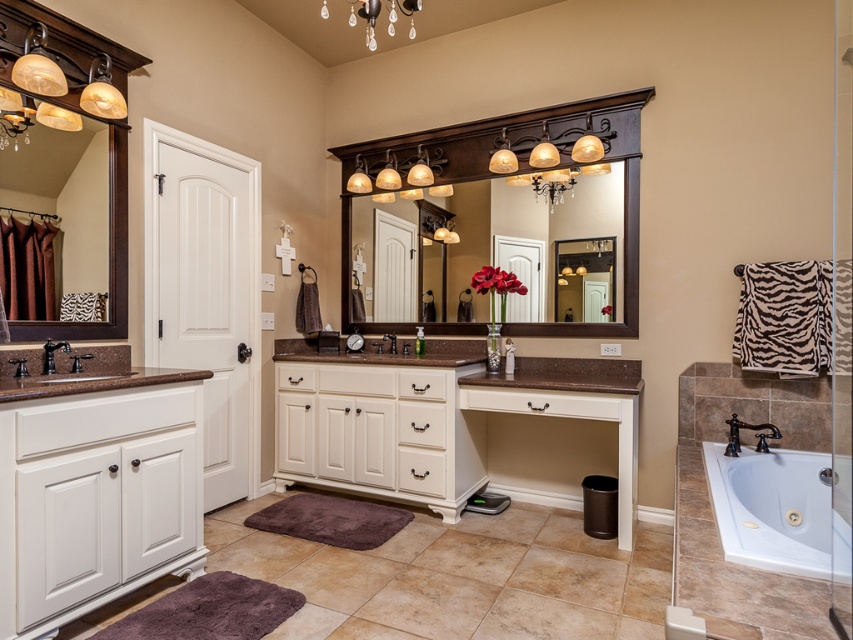
Question: Can you confirm if matte glass mirror at upper left is bigger than crystal glass chandelier at upper center?

Choices:
 (A) yes
 (B) no

Answer: (B)

Question: Among these objects, which one is nearest to the camera?

Choices:
 (A) wooden mirror at center
 (B) matte black faucet at left

Answer: (B)

Question: Can you confirm if wooden mirror at center is wider than brown granite sink at left?

Choices:
 (A) yes
 (B) no

Answer: (A)

Question: Which point is closer to the camera?

Choices:
 (A) (45, 387)
 (B) (480, 132)

Answer: (A)

Question: Does white wood vanity at center appear under brown granite sink at left?

Choices:
 (A) no
 (B) yes

Answer: (B)

Question: Which object is farther from the camera taking this photo?

Choices:
 (A) white ceramic bathtub at lower right
 (B) black matte faucet at center
 (C) white wood vanity at lower left
 (D) brown granite sink at left

Answer: (B)